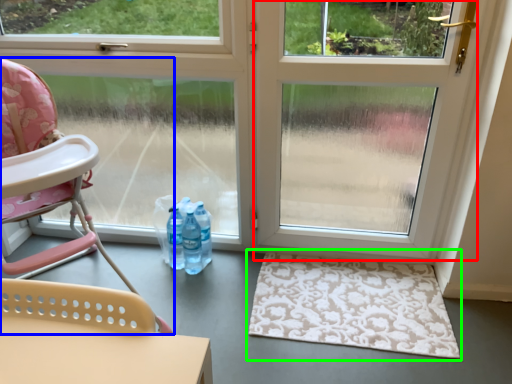
Question: Which is farther away from screen door (highlighted by a red box)? chair (highlighted by a blue box) or doormat (highlighted by a green box)?

Choices:
 (A) chair
 (B) doormat

Answer: (A)